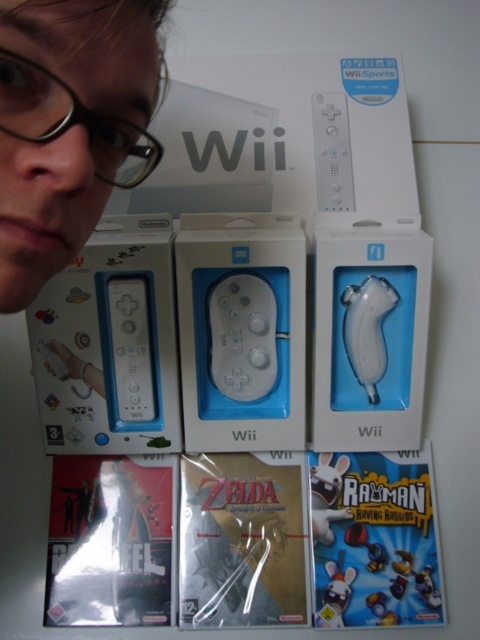
Question: Is the position of white matte wii remote at center more distant than that of matte white mouse at lower center?

Choices:
 (A) yes
 (B) no

Answer: (B)

Question: Is white matte remote at upper center below matte white mouse at lower center?

Choices:
 (A) yes
 (B) no

Answer: (B)

Question: Considering the real-world distances, which object is farthest from the white matte game controller at center?

Choices:
 (A) white matte wii remote at center
 (B) matte white mouse at lower center
 (C) clear plastic glasses at upper left

Answer: (C)

Question: Is matte black face at upper left closer to the viewer compared to white matte wii remote at center?

Choices:
 (A) yes
 (B) no

Answer: (A)

Question: Which object is closer to the camera taking this photo?

Choices:
 (A) white matte wii remote at center
 (B) matte black face at upper left
 (C) white matte game controller at center

Answer: (B)

Question: Which object is closer to the camera taking this photo?

Choices:
 (A) matte white mouse at lower center
 (B) white matte game controller at center
 (C) white matte wii remote at center

Answer: (C)